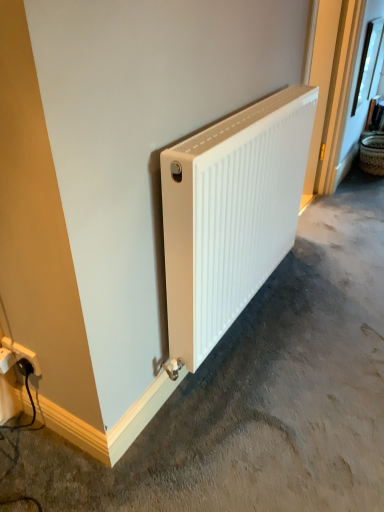
The width and height of the screenshot is (384, 512). What do you see at coordinates (258, 394) in the screenshot?
I see `white matte radiator at center` at bounding box center [258, 394].

You are a GUI agent. You are given a task and a screenshot of the screen. Output one action in this format:
    pyautogui.click(x=<x>, y=<y>)
    Task: Click on the woven brown basket at right
    
    Given the screenshot: What is the action you would take?
    pyautogui.click(x=372, y=155)

The width and height of the screenshot is (384, 512). What do you see at coordinates (372, 155) in the screenshot?
I see `woven brown basket at right` at bounding box center [372, 155].

This screenshot has width=384, height=512. Describe the element at coordinates (231, 214) in the screenshot. I see `white matte radiator at center` at that location.

The height and width of the screenshot is (512, 384). I want to click on clear glass window at upper right, so click(x=368, y=61).

How different are the orientations of white matte radiator at center and woven brown basket at right in degrees?

The angle between the facing direction of white matte radiator at center and the facing direction of woven brown basket at right is 0.000113 degrees.

Is white matte radiator at center turned away from woven brown basket at right?

No, white matte radiator at center is not facing away from woven brown basket at right.

Is white matte radiator at center behind woven brown basket at right?

That is False.

Are white matte radiator at center and woven brown basket at right located far from each other?

Yes, white matte radiator at center and woven brown basket at right are located far from each other.

Is white plastic power plugs and sockets at lower left next to woven brown basket at right and touching it?

No, white plastic power plugs and sockets at lower left is not next to woven brown basket at right.

Is white plastic power plugs and sockets at lower left facing away from woven brown basket at right?

Yes, white plastic power plugs and sockets at lower left is facing away from woven brown basket at right.

Can you confirm if white plastic power plugs and sockets at lower left is shorter than white matte radiator at center?

No.

Is white plastic power plugs and sockets at lower left positioned with its back to white matte radiator at center?

Yes, white plastic power plugs and sockets at lower left is facing away from white matte radiator at center.

Where is `concrete located above the white plastic power plugs and sockets at lower left (from the image's perspective)`? concrete located above the white plastic power plugs and sockets at lower left (from the image's perspective) is located at coordinates (258, 394).

Considering the points (30, 350) and (5, 480), which point is behind, point (30, 350) or point (5, 480)?

The point (30, 350) is more distant.

From the image's perspective, between clear glass window at upper right and white plastic power plugs and sockets at lower left, which one is located above?

clear glass window at upper right, from the image's perspective.

Between clear glass window at upper right and white plastic power plugs and sockets at lower left, which one has larger size?

Bigger between the two is clear glass window at upper right.

Looking at this image, is clear glass window at upper right not inside white plastic power plugs and sockets at lower left?

clear glass window at upper right lies outside white plastic power plugs and sockets at lower left's area.

Is clear glass window at upper right aimed at white plastic power plugs and sockets at lower left?

No, clear glass window at upper right is not aimed at white plastic power plugs and sockets at lower left.

Considering the relative sizes of white plastic power plugs and sockets at lower left and clear glass window at upper right in the image provided, is white plastic power plugs and sockets at lower left taller than clear glass window at upper right?

No, white plastic power plugs and sockets at lower left is not taller than clear glass window at upper right.

Looking at this image, could you tell me if white plastic power plugs and sockets at lower left is facing clear glass window at upper right?

No, white plastic power plugs and sockets at lower left is not aimed at clear glass window at upper right.

Looking at this image, which of these two, white plastic power plugs and sockets at lower left or clear glass window at upper right, is thinner?

With smaller width is white plastic power plugs and sockets at lower left.

Between white plastic power plugs and sockets at lower left and clear glass window at upper right, which one appears on the left side from the viewer's perspective?

Positioned to the left is white plastic power plugs and sockets at lower left.

Which of these two, woven brown basket at right or white matte radiator at center, is smaller?

With smaller size is woven brown basket at right.

Is there a large distance between woven brown basket at right and white matte radiator at center?

woven brown basket at right is positioned a significant distance from white matte radiator at center.

Is point (365, 140) less distant than point (295, 94)?

No.

Is woven brown basket at right not within white matte radiator at center?

Yes.

Which is farther from the camera, (369, 164) or (207, 389)?

Point (369, 164)

From the image's perspective, who appears lower, woven brown basket at right or white matte radiator at center?

white matte radiator at center is shown below in the image.

Consider the image. Considering the positions of objects woven brown basket at right and white matte radiator at center in the image provided, who is in front, woven brown basket at right or white matte radiator at center?

white matte radiator at center is more forward.

In terms of width, does woven brown basket at right look wider or thinner when compared to white matte radiator at center?

Clearly, woven brown basket at right has less width compared to white matte radiator at center.

The width and height of the screenshot is (384, 512). I want to click on concrete that is in front of the woven brown basket at right, so click(258, 394).

Identify the location of basket below the white plastic power plugs and sockets at lower left (from a real-world perspective). The width and height of the screenshot is (384, 512). (372, 155).

From the image, which object appears to be farther from woven brown basket at right, clear glass window at upper right or white matte radiator at center?

white matte radiator at center is further to woven brown basket at right.

Based on the photo, which object lies further to the anchor point white plastic power plugs and sockets at lower left, white matte radiator at center or white matte radiator at center?

white matte radiator at center lies further to white plastic power plugs and sockets at lower left than the other object.

In the scene shown: From the image, which object appears to be nearer to white matte radiator at center, white plastic power plugs and sockets at lower left or white matte radiator at center?

Among the two, white matte radiator at center is located nearer to white matte radiator at center.

When comparing their distances from white matte radiator at center, does woven brown basket at right or white plastic power plugs and sockets at lower left seem further?

woven brown basket at right lies further to white matte radiator at center than the other object.

Which object lies nearer to the anchor point clear glass window at upper right, white matte radiator at center or white matte radiator at center?

white matte radiator at center is closer to clear glass window at upper right.

From the picture: From the image, which object appears to be farther from woven brown basket at right, white plastic power plugs and sockets at lower left or white matte radiator at center?

The object further to woven brown basket at right is white plastic power plugs and sockets at lower left.

Estimate the real-world distances between objects in this image. Which object is closer to white matte radiator at center, white plastic power plugs and sockets at lower left or woven brown basket at right?

white plastic power plugs and sockets at lower left.

Estimate the real-world distances between objects in this image. Which object is further from white plastic power plugs and sockets at lower left, woven brown basket at right or white matte radiator at center?

woven brown basket at right is further to white plastic power plugs and sockets at lower left.

You are a GUI agent. You are given a task and a screenshot of the screen. Output one action in this format:
    pyautogui.click(x=<x>, y=<y>)
    Task: Click on the power plugs and sockets between white matte radiator at center and woven brown basket at right from front to back
    This screenshot has height=512, width=384.
    Given the screenshot: What is the action you would take?
    pyautogui.click(x=22, y=353)

Identify the location of radiator between white plastic power plugs and sockets at lower left and clear glass window at upper right from left to right. tap(231, 214).

Where is `window between white matte radiator at center and woven brown basket at right along the z-axis`? This screenshot has width=384, height=512. window between white matte radiator at center and woven brown basket at right along the z-axis is located at coordinates (368, 61).

At what (x,y) coordinates should I click in order to perform the action: click on power plugs and sockets between white matte radiator at center and woven brown basket at right from front to back. Please return your answer as a coordinate pair (x, y). The width and height of the screenshot is (384, 512). Looking at the image, I should click on (22, 353).